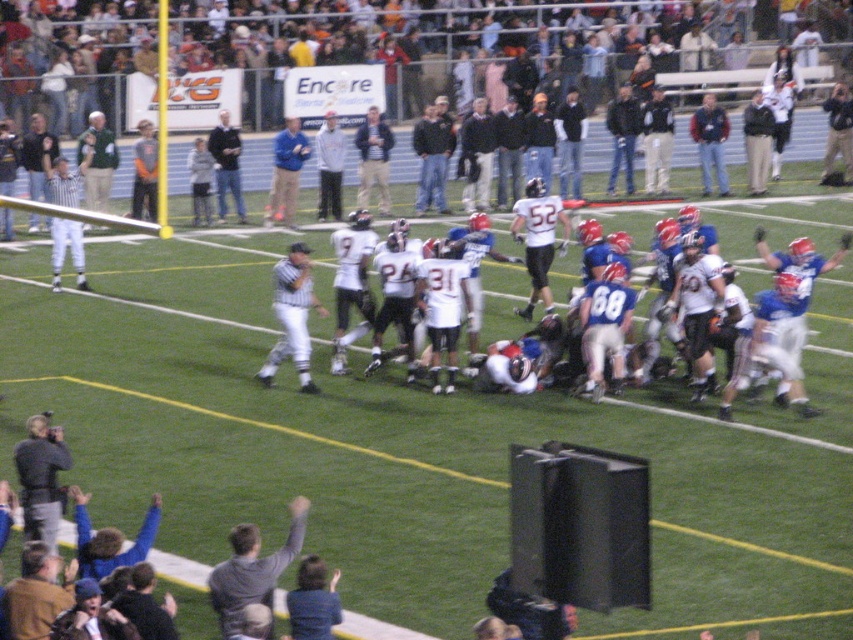
Question: Which of the following is the closest to the observer?

Choices:
 (A) (548, 208)
 (B) (820, 282)

Answer: (A)

Question: Considering the relative positions of white matte jersey at center and blue jacket at center in the image provided, where is white matte jersey at center located with respect to blue jacket at center?

Choices:
 (A) left
 (B) right

Answer: (B)

Question: Does dark clothing at upper center appear on the left side of white uniformed referee at center?

Choices:
 (A) yes
 (B) no

Answer: (B)

Question: Can you confirm if white striped referee at left is positioned to the left of blue jacket at center?

Choices:
 (A) yes
 (B) no

Answer: (A)

Question: Which of the following is the closest to the observer?

Choices:
 (A) pos(45,61)
 (B) pos(273,177)
 (C) pos(532,253)
 (D) pos(830,284)

Answer: (C)

Question: Which object is closer to the camera taking this photo?

Choices:
 (A) white striped referee at left
 (B) white matte jersey at center
 (C) blue denim jeans at center

Answer: (B)